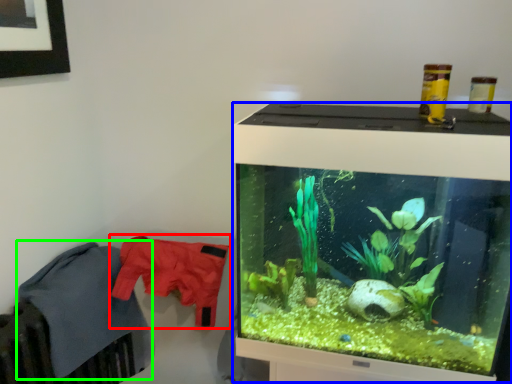
Question: Which object is the closest to the clothing (highlighted by a red box)? Choose among these: computer monitor (highlighted by a blue box) or clothing (highlighted by a green box).

Choices:
 (A) computer monitor
 (B) clothing

Answer: (B)